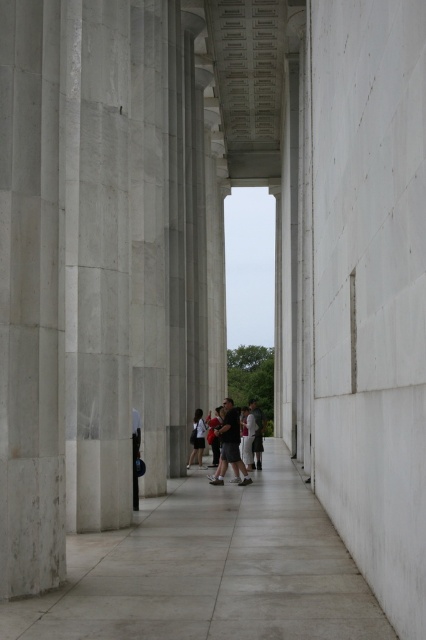
Question: Which point is closer to the camera taking this photo?

Choices:
 (A) (189, 460)
 (B) (221, 616)
 (C) (227, 424)

Answer: (B)

Question: Does gray concrete pavement at center lie in front of dark gray fabric jacket at center?

Choices:
 (A) no
 (B) yes

Answer: (B)

Question: Which object is farther from the camera taking this photo?

Choices:
 (A) dark gray fabric jacket at center
 (B) gray concrete pavement at center

Answer: (A)

Question: In this image, where is gray concrete pavement at center located relative to dark gray fabric pants at center?

Choices:
 (A) below
 (B) above

Answer: (A)

Question: Can you confirm if gray concrete pavement at center is positioned to the left of dark gray fabric pants at center?

Choices:
 (A) yes
 (B) no

Answer: (A)

Question: Estimate the real-world distances between objects in this image. Which object is closer to the dark gray fabric jacket at center?

Choices:
 (A) gray concrete pavement at center
 (B) dark gray fabric pants at center

Answer: (B)